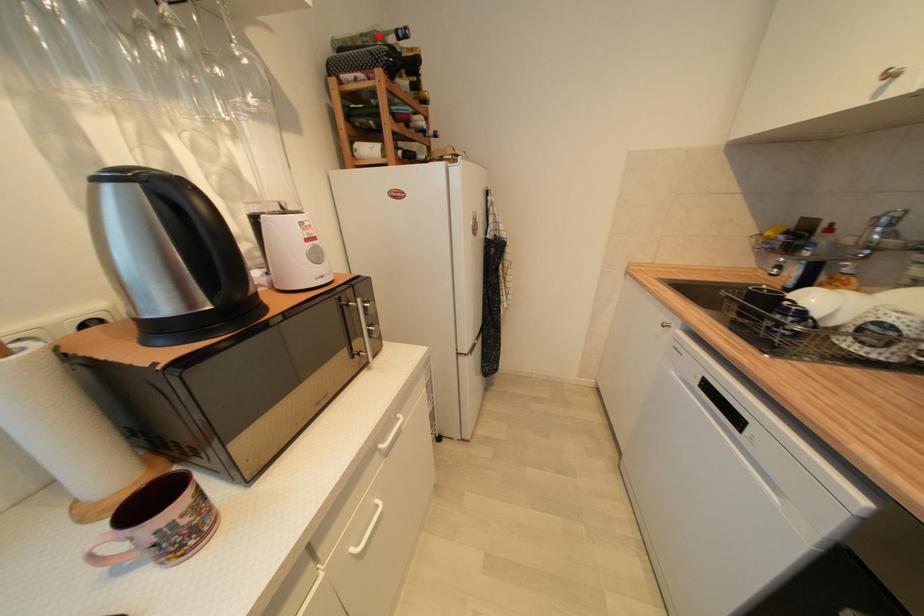
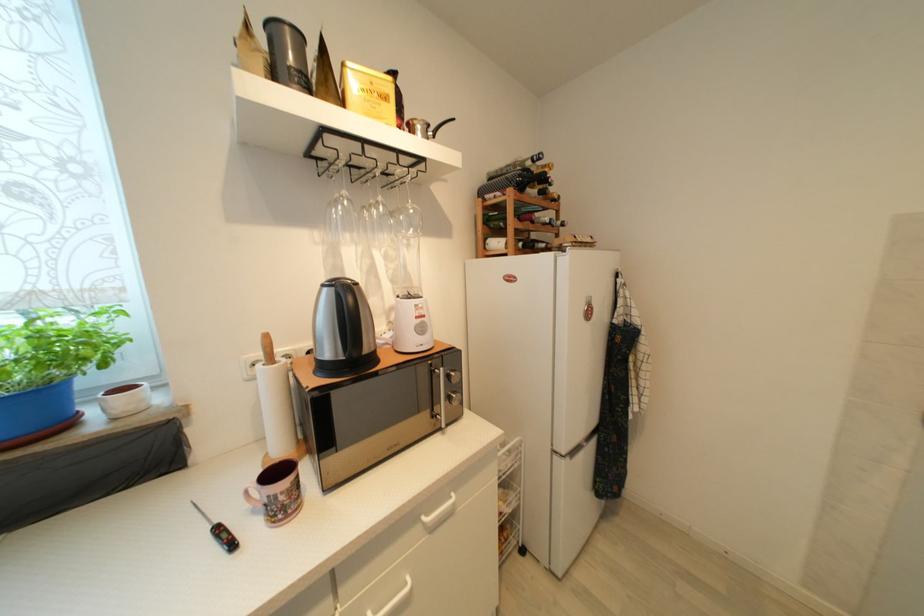
Locate, in the second image, the point that corresponds to the highlighted location in the first image.

(518, 166)